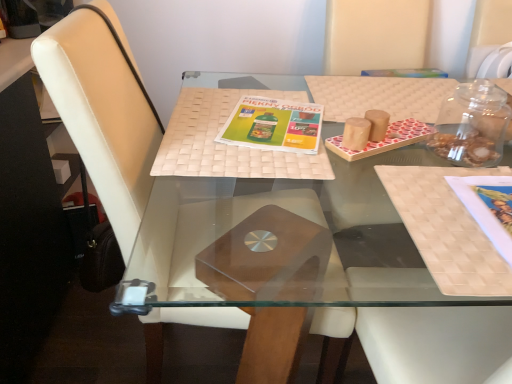
Locate an element on the screen. vacant space to the left of green matte magazine at center, arranged as the 2th book cover when ordered from the bottom is located at coordinates (196, 121).